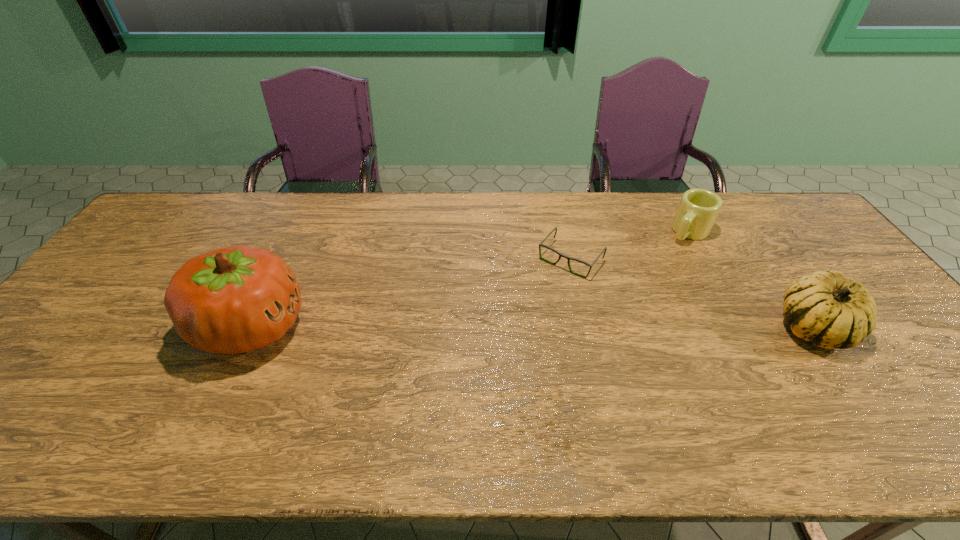
The image size is (960, 540). Identify the location of free space at the left edge of the desktop. (111, 309).

Where is `free location at the right edge of the desktop`? free location at the right edge of the desktop is located at coordinates (881, 340).

Find the location of a particular element. The width and height of the screenshot is (960, 540). free space at the far right corner of the desktop is located at coordinates (753, 197).

You are a GUI agent. You are given a task and a screenshot of the screen. Output one action in this format:
    pyautogui.click(x=<x>, y=<y>)
    Task: Click on the vacant region between the second tallest object and the pumpkin
    The height and width of the screenshot is (540, 960).
    Given the screenshot: What is the action you would take?
    pyautogui.click(x=532, y=327)

You are a GUI agent. You are given a task and a screenshot of the screen. Output one action in this format:
    pyautogui.click(x=<x>, y=<y>)
    Task: Click on the free space that is in between the leftmost object and the second object from left to right
    This screenshot has width=960, height=540.
    Given the screenshot: What is the action you would take?
    point(411,293)

At what (x,y) coordinates should I click in order to perform the action: click on blank region between the rightmost object and the second shortest object. Please return your answer as a coordinate pair (x, y). This screenshot has height=540, width=960. Looking at the image, I should click on (751, 280).

Locate an element on the screen. vacant region between the third object from right to left and the second shortest object is located at coordinates (630, 246).

The height and width of the screenshot is (540, 960). Identify the location of free spot between the mug and the pumpkin. (469, 279).

At what (x,y) coordinates should I click in order to perform the action: click on vacant area between the third tallest object and the spectacles. Please return your answer as a coordinate pair (x, y). The height and width of the screenshot is (540, 960). Looking at the image, I should click on (630, 246).

You are a GUI agent. You are given a task and a screenshot of the screen. Output one action in this format:
    pyautogui.click(x=<x>, y=<y>)
    Task: Click on the free point between the second object from left to right and the third object from left to right
    Image resolution: width=960 pixels, height=540 pixels.
    Given the screenshot: What is the action you would take?
    pyautogui.click(x=630, y=246)